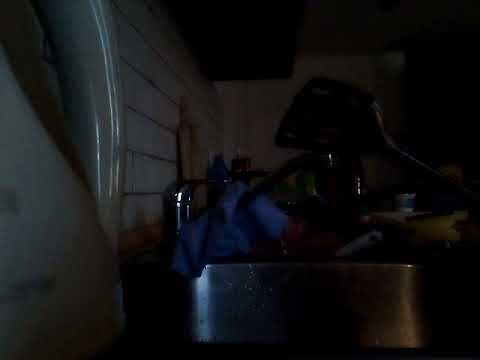
Identify the location of backsplash. The height and width of the screenshot is (360, 480). (144, 166).